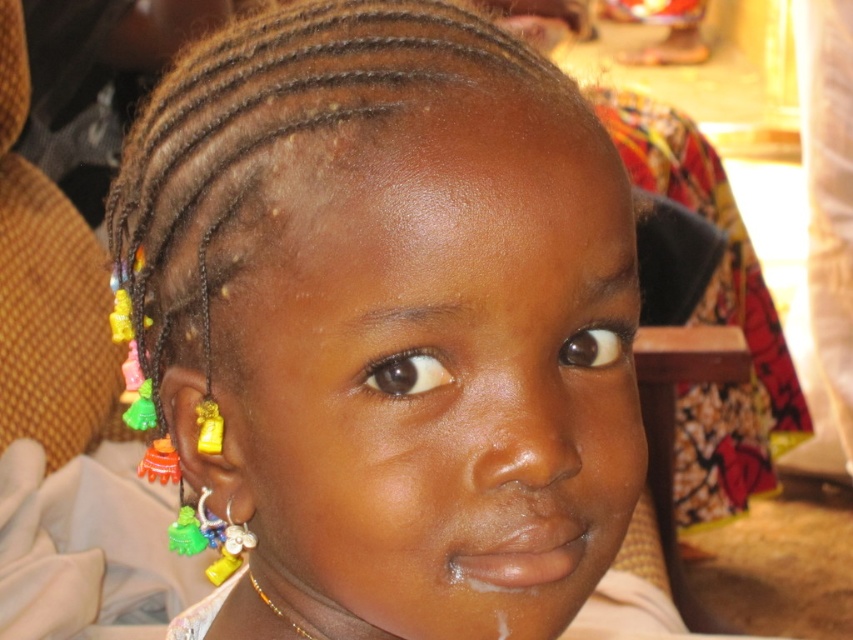
The image size is (853, 640). Identify the location of multicolored beaded earrings at center. (389, 316).

Is multicolored beaded earrings at center positioned behind gold beaded necklace at lower center?

No, multicolored beaded earrings at center is in front of gold beaded necklace at lower center.

Which is behind, point (169, 397) or point (283, 620)?

The point (283, 620) is behind.

Where is `multicolored beaded earrings at center`? This screenshot has height=640, width=853. multicolored beaded earrings at center is located at coordinates (389, 316).